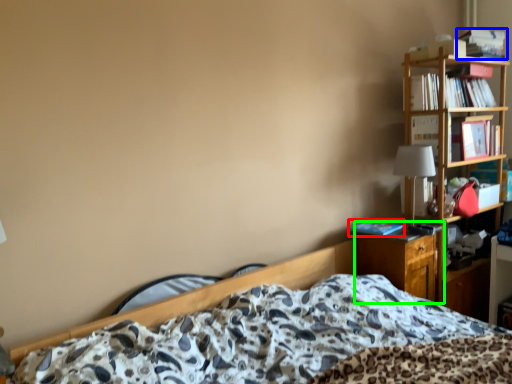
Question: Which is farther away from book (highlighted by a red box)? book (highlighted by a blue box) or nightstand (highlighted by a green box)?

Choices:
 (A) book
 (B) nightstand

Answer: (A)